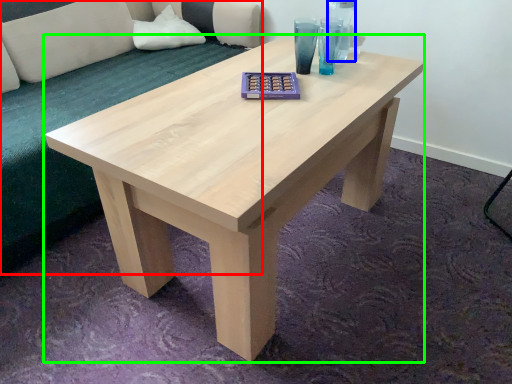
Question: Considering the real-world distances, which object is closest to couch (highlighted by a red box)? glass vase (highlighted by a blue box) or coffee table (highlighted by a green box).

Choices:
 (A) glass vase
 (B) coffee table

Answer: (B)